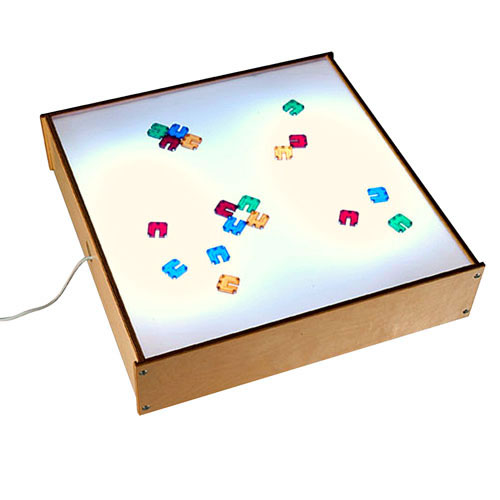
Locate an element on the screen. This screenshot has width=500, height=500. blue play tile is located at coordinates (173, 275), (223, 252), (384, 198), (181, 133), (232, 228).